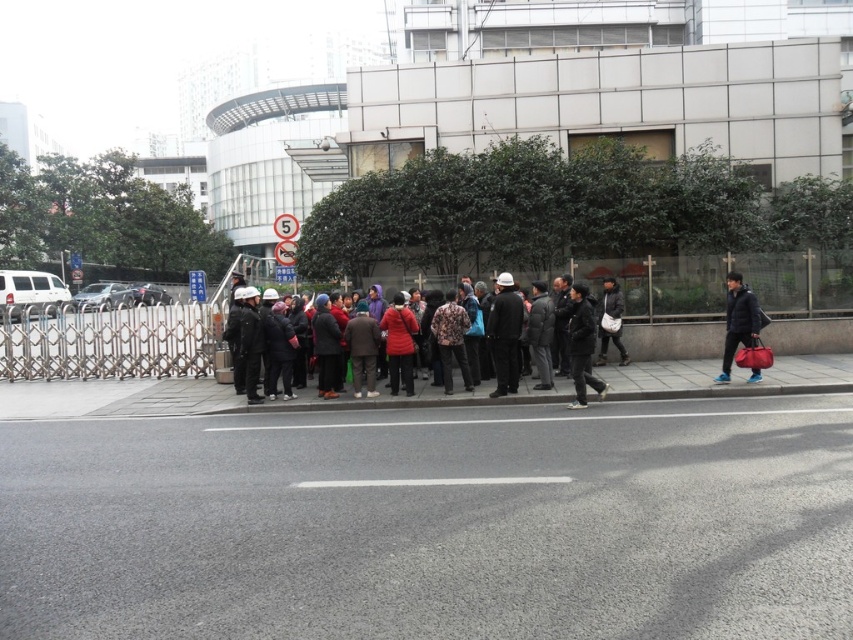
Question: From the image, what is the correct spatial relationship of patterned fabric jacket at center in relation to dark brown leather jacket at center?

Choices:
 (A) left
 (B) right

Answer: (A)

Question: Does dark gray fabric jacket at center appear under matte black jacket at right?

Choices:
 (A) no
 (B) yes

Answer: (B)

Question: Which point is farther from the camera taking this photo?

Choices:
 (A) (601, 308)
 (B) (433, 330)
 (C) (32, 563)
 (D) (701, 412)

Answer: (A)

Question: Which object is farther from the camera taking this photo?

Choices:
 (A) patterned fabric jacket at center
 (B) dark gray fabric jacket at center
 (C) matte black helmet at center
 (D) dark gray jacket at center

Answer: (A)

Question: Estimate the real-world distances between objects in this image. Which object is closer to the dark brown leather jacket at center?

Choices:
 (A) matte black helmet at center
 (B) dark gray jacket at center

Answer: (A)

Question: Is dark gray fabric jacket at center to the right of matte black jacket at right from the viewer's perspective?

Choices:
 (A) yes
 (B) no

Answer: (B)